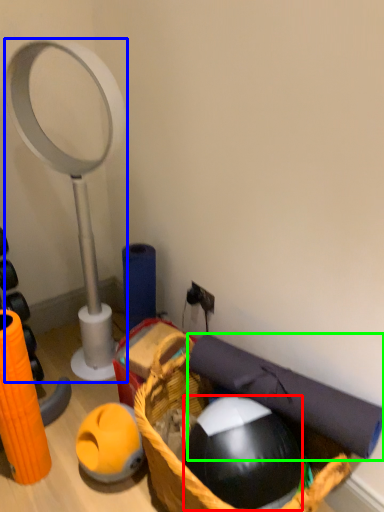
Question: Considering the real-world distances, which object is farthest from ball (highlighted by a red box)? magnifying glass (highlighted by a blue box) or yoga mat (highlighted by a green box)?

Choices:
 (A) magnifying glass
 (B) yoga mat

Answer: (A)